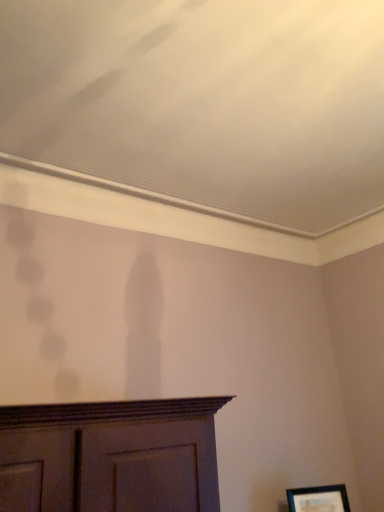
The image size is (384, 512). What do you see at coordinates (318, 499) in the screenshot? I see `dark blue wooden picture frame at lower right` at bounding box center [318, 499].

Where is `dark blue wooden picture frame at lower right`? The height and width of the screenshot is (512, 384). dark blue wooden picture frame at lower right is located at coordinates (318, 499).

At what (x,y) coordinates should I click in order to perform the action: click on dark blue wooden picture frame at lower right. Please return your answer as a coordinate pair (x, y). Looking at the image, I should click on (318, 499).